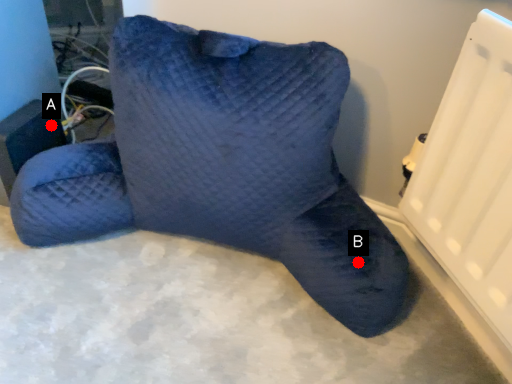
Question: Two points are circled on the image, labeled by A and B beside each circle. Which point is farther from the camera taking this photo?

Choices:
 (A) A is further
 (B) B is further

Answer: (A)